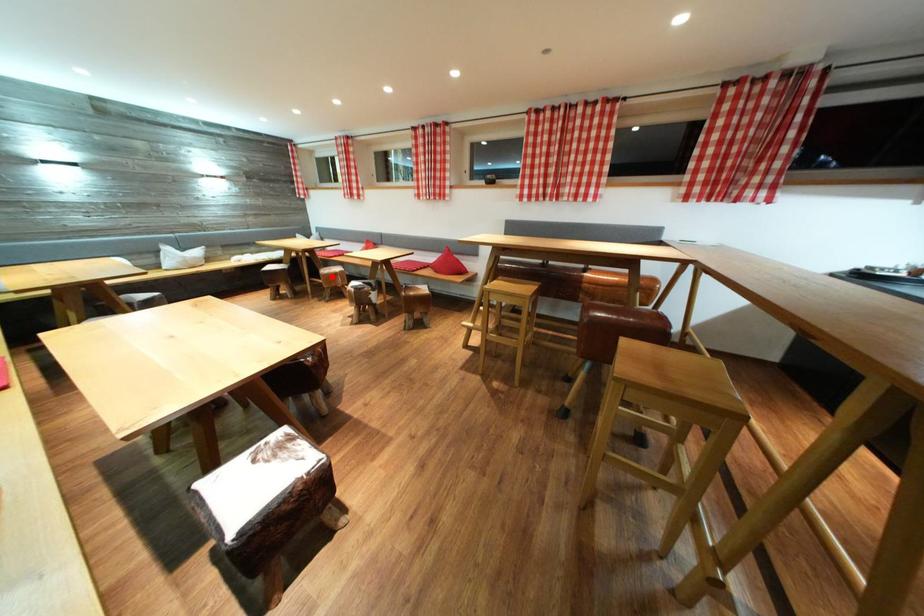
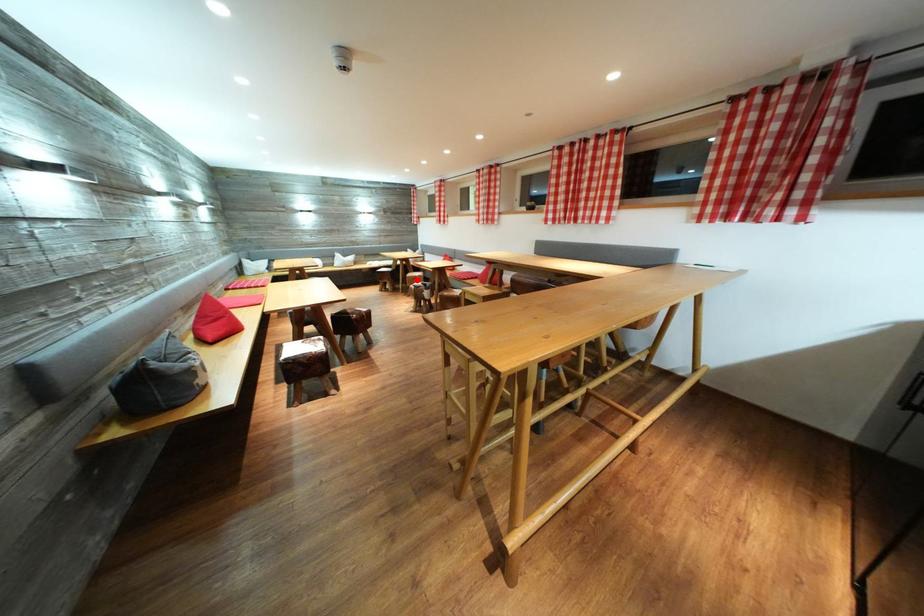
I am providing you with two images of the same scene from different viewpoints. A red point is marked on the first image and another point is marked on the second image. Do the highlighted points in image1 and image2 indicate the same real-world spot?

Yes